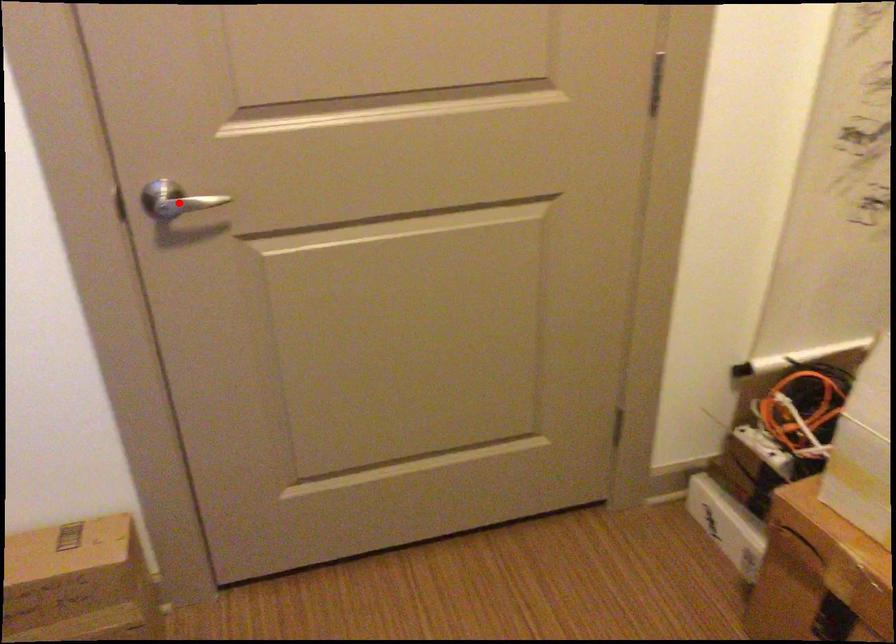
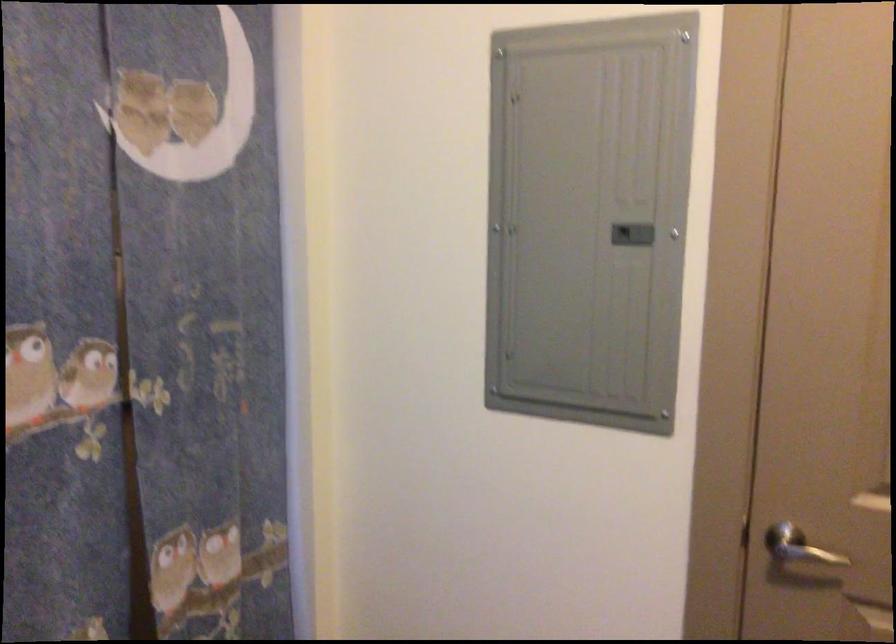
Locate, in the second image, the point that corresponds to the highlighted location in the first image.

(806, 554)